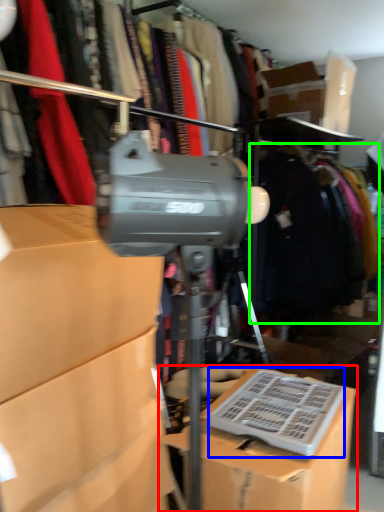
Question: Which is nearer to the box (highlighted by a red box)? wide (highlighted by a blue box) or clothing (highlighted by a green box).

Choices:
 (A) wide
 (B) clothing

Answer: (A)